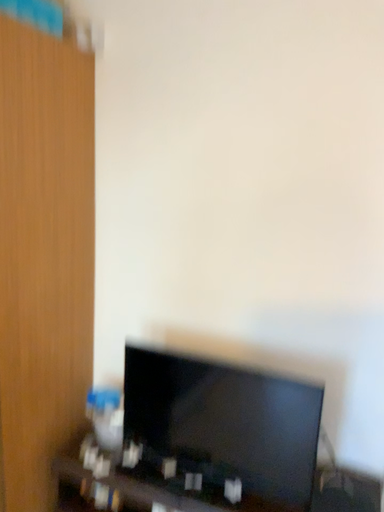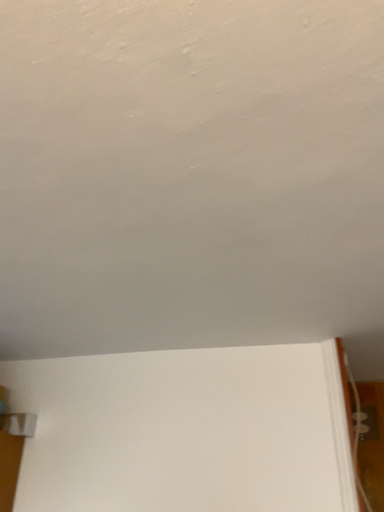
Question: Which way did the camera rotate in the video?

Choices:
 (A) rotated left
 (B) rotated right

Answer: (B)